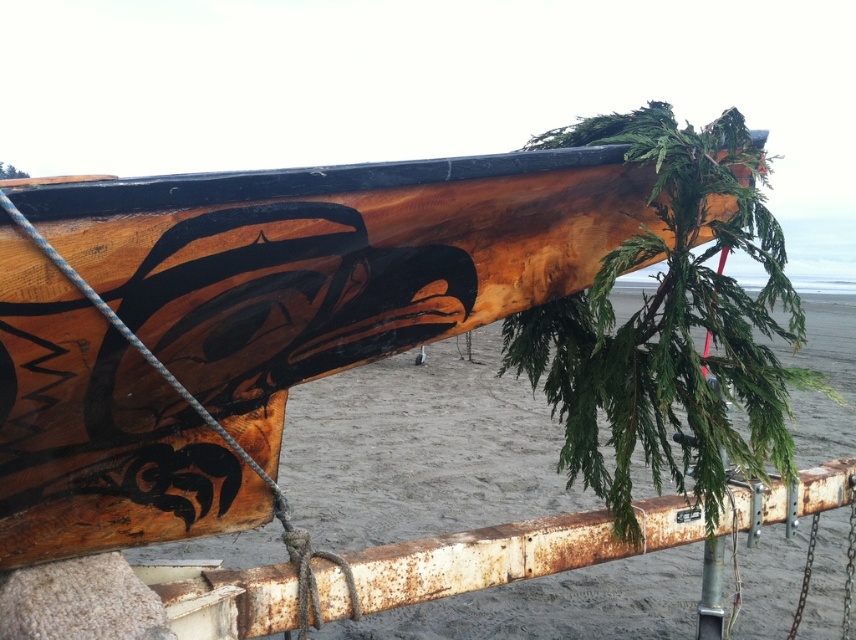
Can you confirm if wooden canoe at center is positioned below rusty metal rail at lower center?

Actually, wooden canoe at center is above rusty metal rail at lower center.

Can you confirm if wooden canoe at center is smaller than rusty metal rail at lower center?

Actually, wooden canoe at center might be larger than rusty metal rail at lower center.

Which is in front, point (367, 188) or point (321, 595)?

Positioned in front is point (367, 188).

Where is `wooden canoe at center`? Image resolution: width=856 pixels, height=640 pixels. wooden canoe at center is located at coordinates (342, 259).